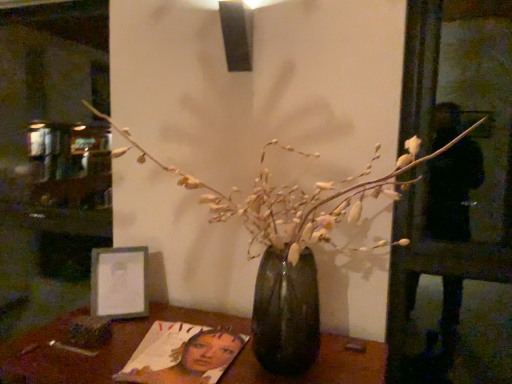
Identify the location of free spot to the left of matte paper magazine at lower center. (79, 349).